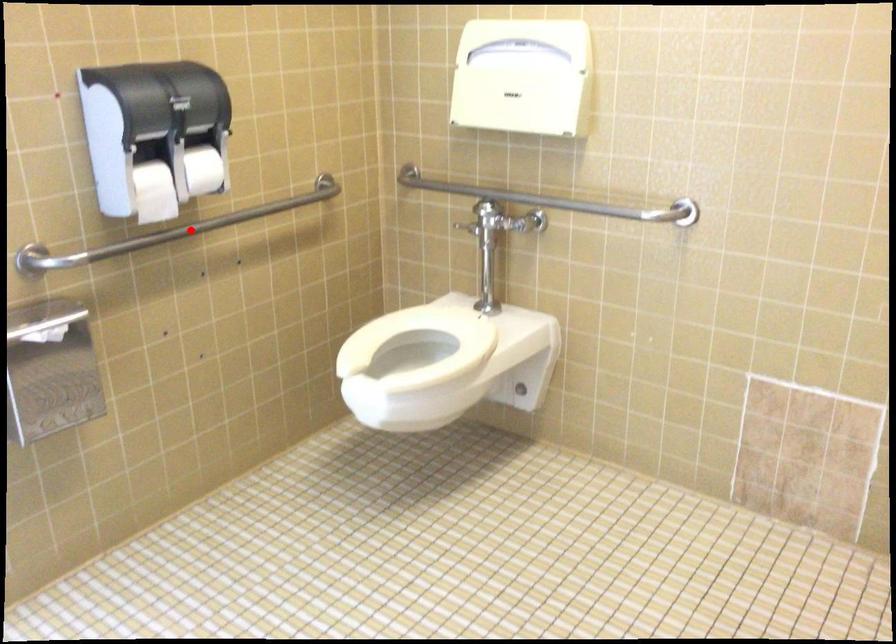
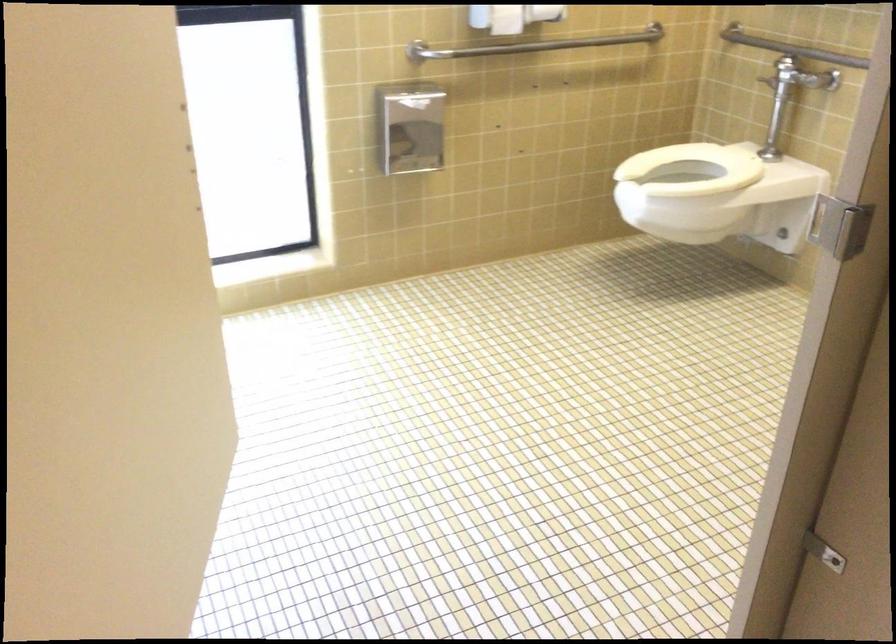
The point at the highlighted location is marked in the first image. Where is the corresponding point in the second image?

(531, 44)